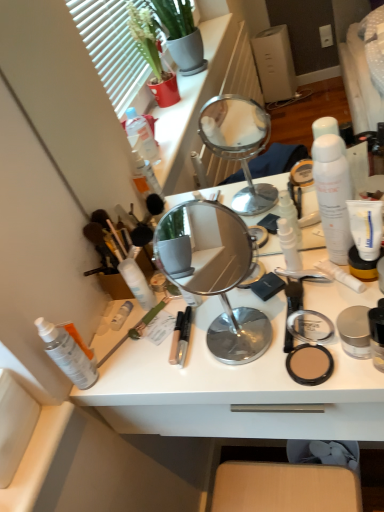
You are a GUI agent. You are given a task and a screenshot of the screen. Output one action in this format:
    pyautogui.click(x=<x>, y=<y>)
    Task: Click on the free space between white matte spray can at center, which is the fourth toiletry in left-to-right order, and white matte tube at right, the first toothpaste when ordered from bottom to top
    
    Given the screenshot: What is the action you would take?
    pyautogui.click(x=241, y=293)